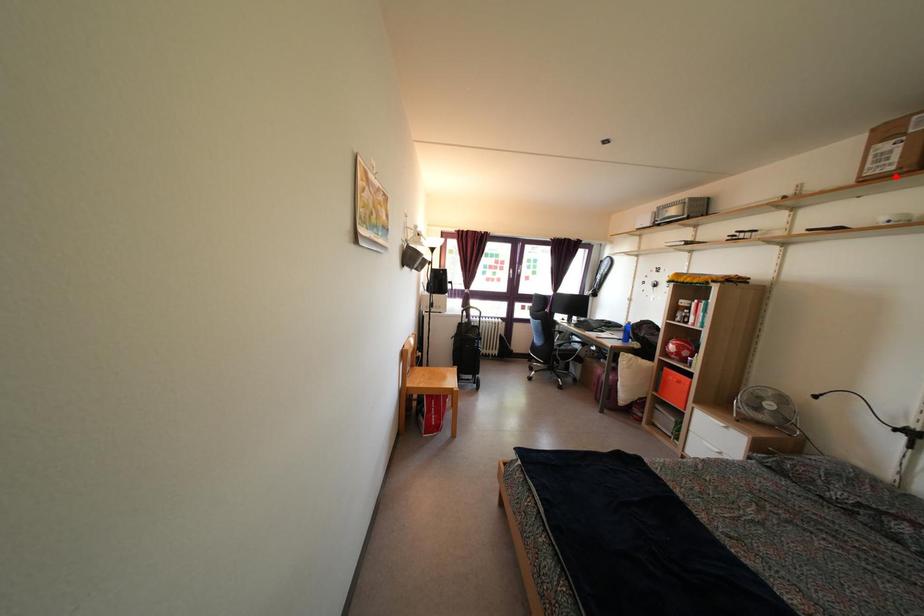
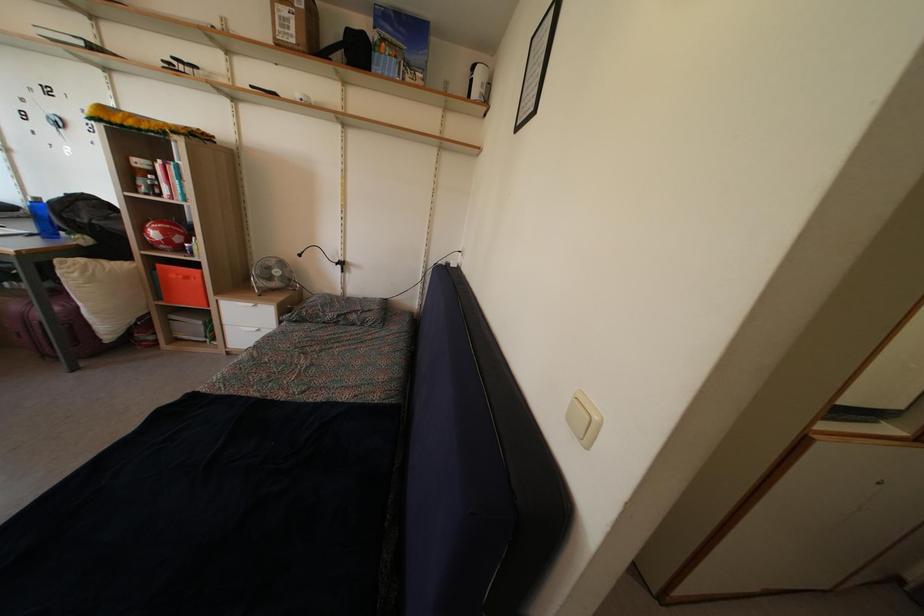
Locate, in the second image, the point that corresponds to the highlighted location in the first image.

(296, 50)